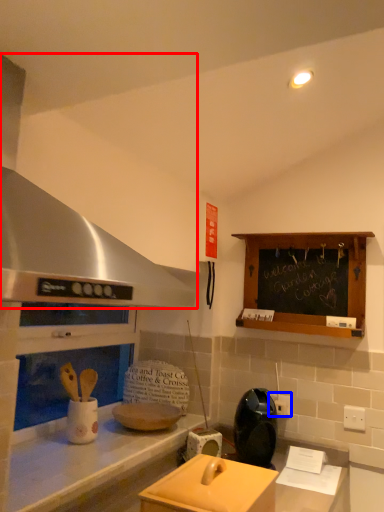
Question: Among these objects, which one is farthest to the camera, exhaust hood (highlighted by a red box) or electric outlet (highlighted by a blue box)?

Choices:
 (A) exhaust hood
 (B) electric outlet

Answer: (B)